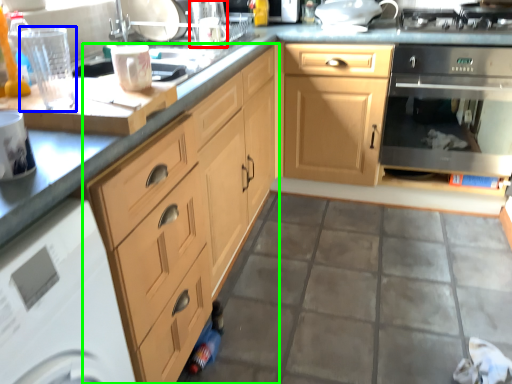
Question: Considering the real-world distances, which object is closest to appliance (highlighted by a red box)? appliance (highlighted by a blue box) or cabinetry (highlighted by a green box).

Choices:
 (A) appliance
 (B) cabinetry

Answer: (B)